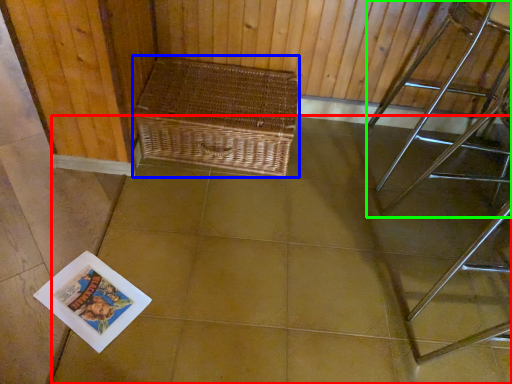
Question: Which object is the closest to the square (highlighted by a red box)? Choose among these: picnic basket (highlighted by a blue box) or furniture (highlighted by a green box).

Choices:
 (A) picnic basket
 (B) furniture

Answer: (A)